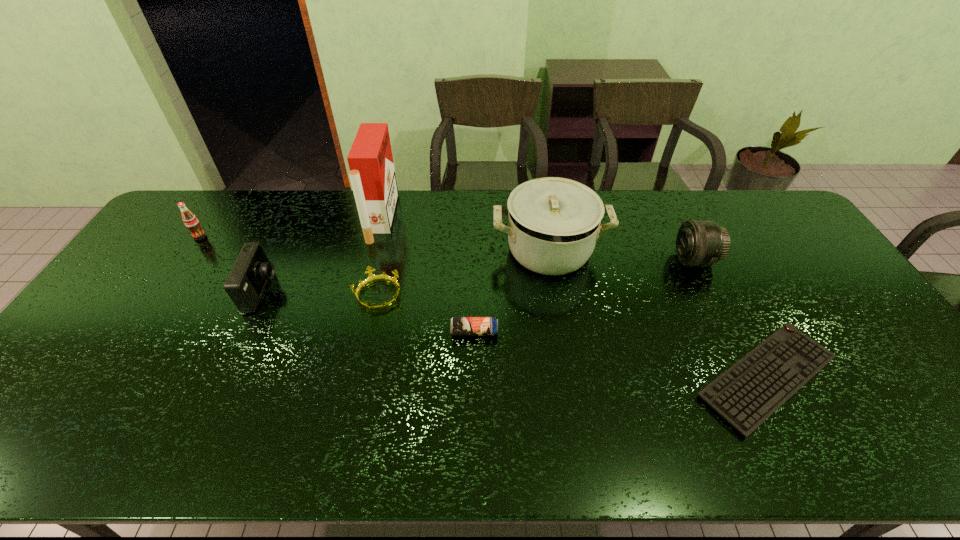
Where is `soda at the far edge`? soda at the far edge is located at coordinates (191, 222).

The image size is (960, 540). Find the location of `object that is at the near edge`. object that is at the near edge is located at coordinates (750, 391).

Identify the location of object present at the left edge. The image size is (960, 540). (191, 222).

You are a GUI agent. You are given a task and a screenshot of the screen. Output one action in this format:
    pyautogui.click(x=<x>, y=<y>)
    Task: Click on the object positioned at the far left corner
    The height and width of the screenshot is (540, 960).
    Given the screenshot: What is the action you would take?
    pyautogui.click(x=191, y=222)

In order to click on vacant space at the far edge of the desktop in this screenshot , I will do pos(659,199).

Identify the location of free spot at the near edge of the desktop. The height and width of the screenshot is (540, 960). (249, 433).

Where is `free space at the right edge of the desktop`? Image resolution: width=960 pixels, height=540 pixels. free space at the right edge of the desktop is located at coordinates (876, 350).

Locate an element on the screen. Image resolution: width=960 pixels, height=540 pixels. free space at the far left corner of the desktop is located at coordinates (209, 205).

In the image, there is a desktop. Identify the location of vacant region at the near left corner. (39, 462).

The width and height of the screenshot is (960, 540). I want to click on empty space between the soda and the beer can, so click(x=337, y=284).